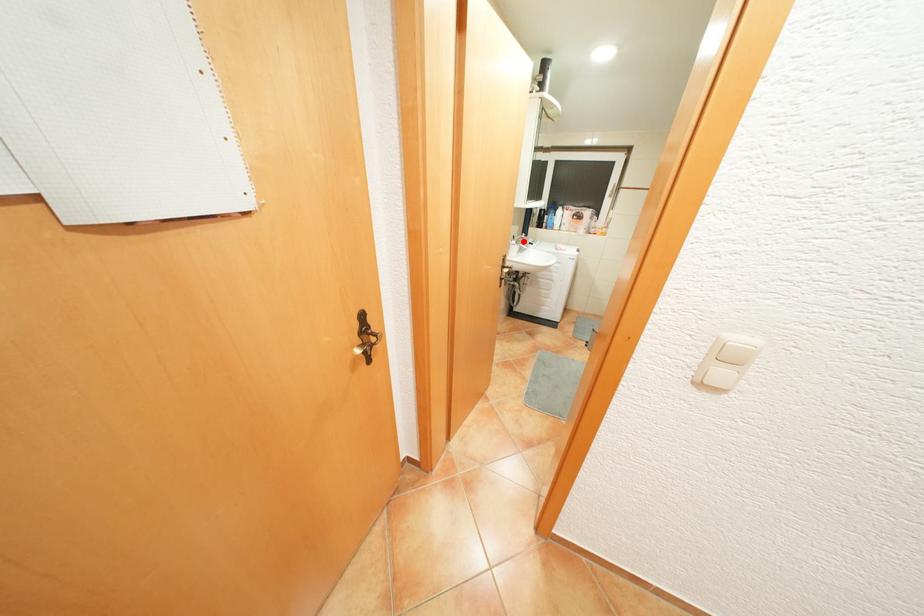
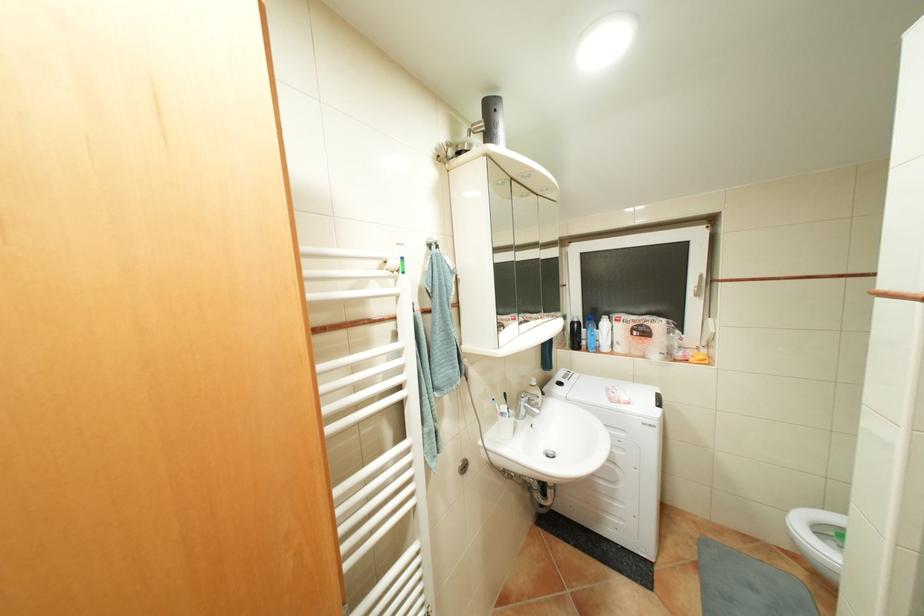
The point at the highlighted location is marked in the first image. Where is the corresponding point in the second image?

(514, 408)